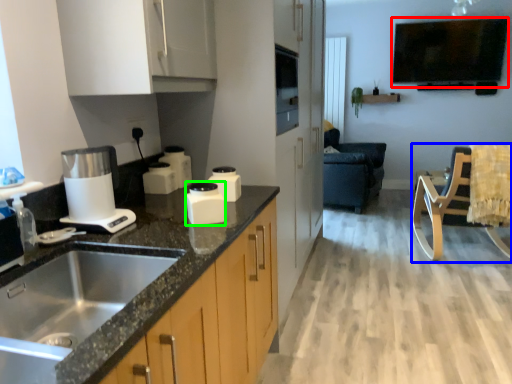
Question: Which is nearer to the window screen (highlighted by a red box)? rocking chair (highlighted by a blue box) or kitchen appliance (highlighted by a green box).

Choices:
 (A) rocking chair
 (B) kitchen appliance

Answer: (A)